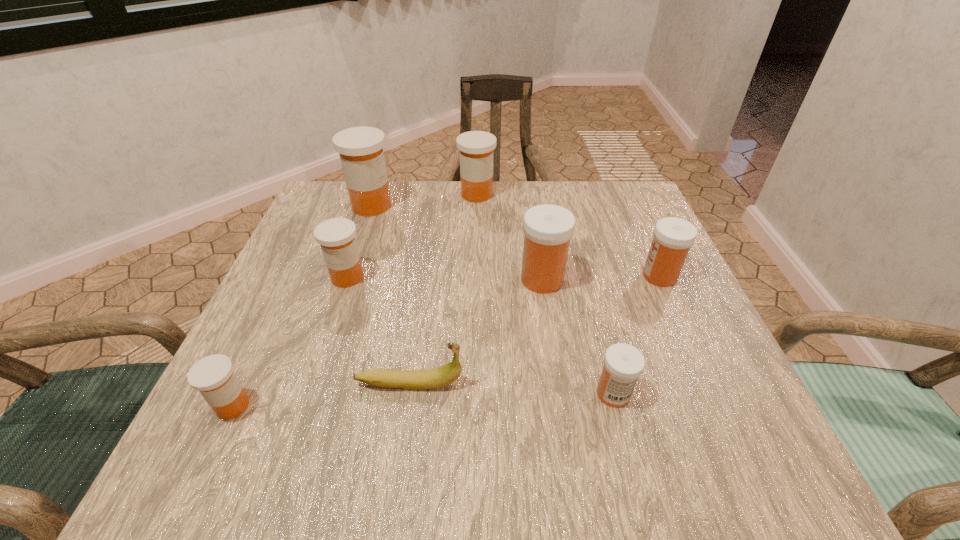
Locate an element on the screen. vacant space that satisfies the following two spatial constraints: 1. on the label of the leftmost white medicine; 2. on the right side of the rightmost orange medicine is located at coordinates (476, 279).